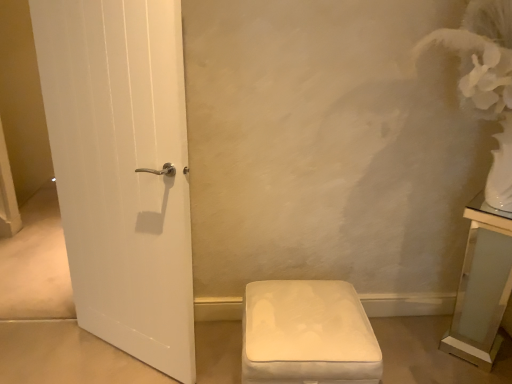
Question: Is point tap(498, 223) positioned closer to the camera than point tap(274, 365)?

Choices:
 (A) farther
 (B) closer

Answer: (A)

Question: Is clear glass vanity at right inside the boundaries of white fabric ottoman at lower center, or outside?

Choices:
 (A) outside
 (B) inside

Answer: (A)

Question: Considering the positions of clear glass vanity at right and white fabric ottoman at lower center in the image, is clear glass vanity at right bigger or smaller than white fabric ottoman at lower center?

Choices:
 (A) big
 (B) small

Answer: (B)

Question: From a real-world perspective, is white fabric ottoman at lower center above or below clear glass vanity at right?

Choices:
 (A) below
 (B) above

Answer: (A)

Question: Choose the correct answer: Is white fabric ottoman at lower center inside clear glass vanity at right or outside it?

Choices:
 (A) inside
 (B) outside

Answer: (B)

Question: Looking at their shapes, would you say white fabric ottoman at lower center is wider or thinner than clear glass vanity at right?

Choices:
 (A) thin
 (B) wide

Answer: (B)

Question: Is point (325, 332) positioned closer to the camera than point (478, 225)?

Choices:
 (A) farther
 (B) closer

Answer: (B)